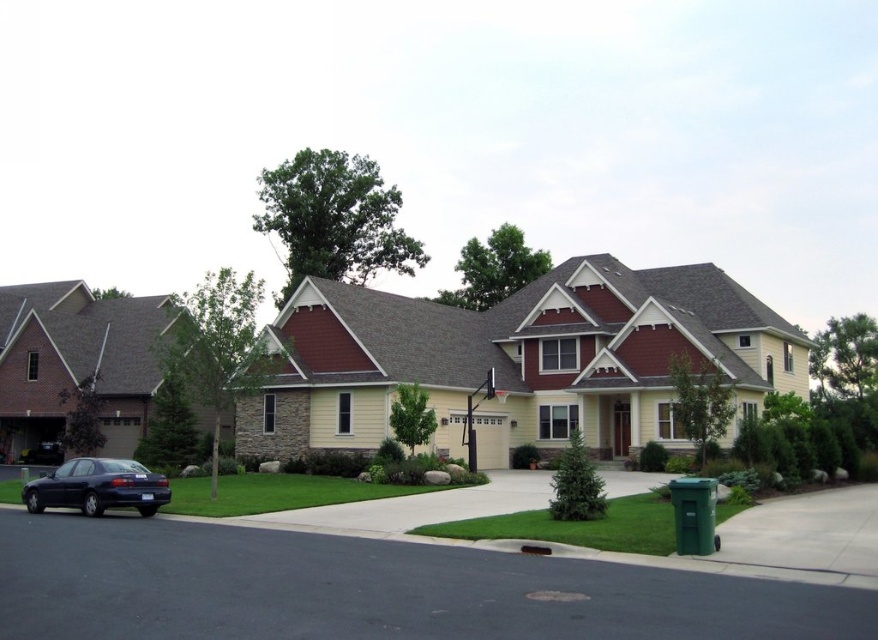
Is asphalt at lower center shorter than shiny dark blue sedan at lower left?

Yes.

Can you confirm if asphalt at lower center is smaller than shiny dark blue sedan at lower left?

Correct, asphalt at lower center occupies less space than shiny dark blue sedan at lower left.

Does point (648, 637) lie behind point (92, 486)?

No, (648, 637) is closer to viewer.

Image resolution: width=878 pixels, height=640 pixels. Find the location of `asphalt at lower center`. asphalt at lower center is located at coordinates (372, 589).